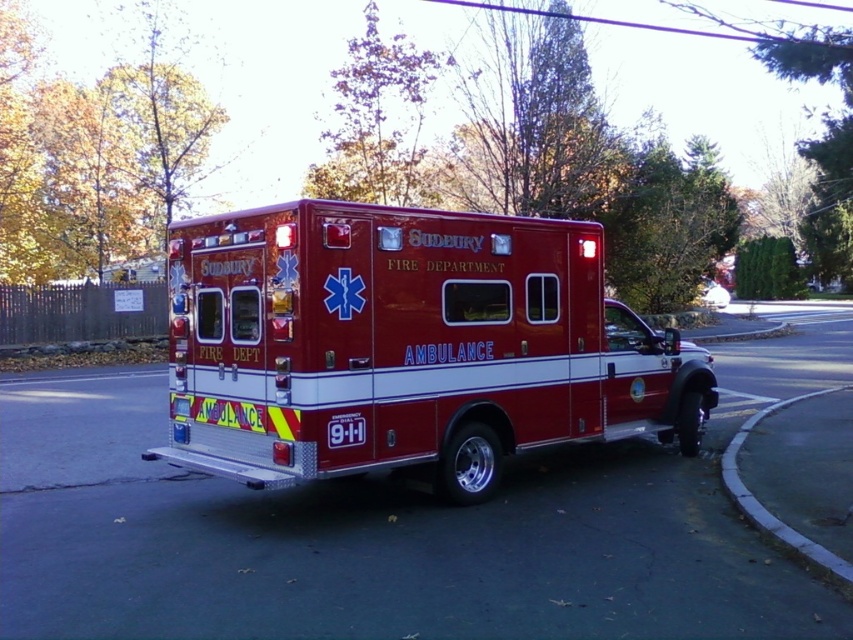
Question: Is shiny red ambulance at center positioned before gray concrete curb at lower right?

Choices:
 (A) yes
 (B) no

Answer: (B)

Question: Which point is closer to the camera taking this photo?

Choices:
 (A) (218, 237)
 (B) (782, 524)

Answer: (B)

Question: Is shiny red ambulance at center thinner than gray concrete curb at lower right?

Choices:
 (A) yes
 (B) no

Answer: (A)

Question: Is shiny red ambulance at center positioned at the back of gray concrete curb at lower right?

Choices:
 (A) yes
 (B) no

Answer: (A)